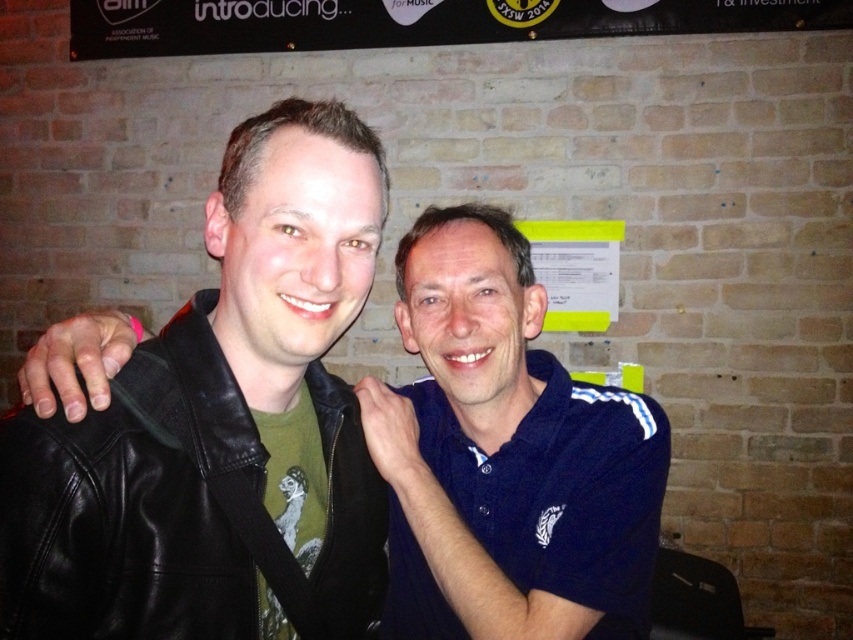
Question: Does black leather jacket at center lie in front of blue cotton polo shirt at center?

Choices:
 (A) no
 (B) yes

Answer: (B)

Question: Which object is closer to the camera taking this photo?

Choices:
 (A) black leather jacket at center
 (B) blue cotton polo shirt at center
 (C) black plastic banner at upper center

Answer: (A)

Question: Which object is closer to the camera taking this photo?

Choices:
 (A) black leather jacket at center
 (B) blue cotton polo shirt at center

Answer: (A)

Question: Considering the relative positions of black leather jacket at center and black plastic banner at upper center in the image provided, where is black leather jacket at center located with respect to black plastic banner at upper center?

Choices:
 (A) above
 (B) below

Answer: (B)

Question: Which point is farther to the camera?

Choices:
 (A) (234, 26)
 (B) (209, 589)
 (C) (479, 458)
 (D) (413, 618)

Answer: (A)

Question: Does black leather jacket at center appear over blue cotton polo shirt at center?

Choices:
 (A) yes
 (B) no

Answer: (A)